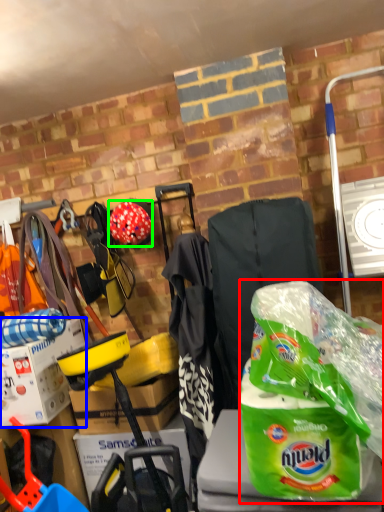
Question: Estimate the real-world distances between objects in this image. Which object is farther from plastic bag (highlighted by a red box), box (highlighted by a blue box) or helmet (highlighted by a green box)?

Choices:
 (A) box
 (B) helmet

Answer: (A)